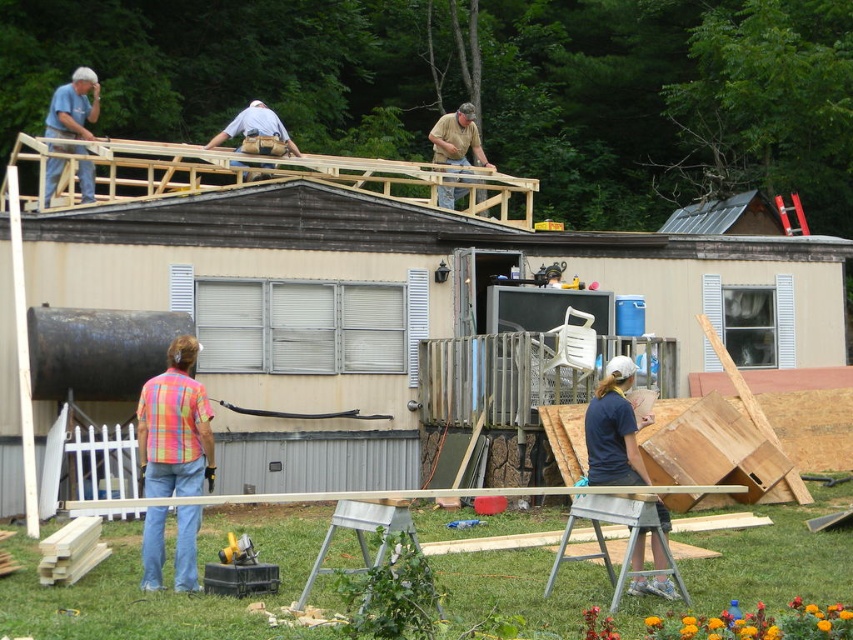
Does point (173, 420) come closer to viewer compared to point (627, 419)?

No, (173, 420) is further to viewer.

Is multicolored plaid shirt at lower left positioned in front of blue fabric shirt at center?

No, it is not.

Is point (177, 364) closer to viewer compared to point (637, 532)?

No, it is not.

Identify the location of multicolored plaid shirt at lower left. This screenshot has height=640, width=853. (173, 426).

Between matte blue shirt at upper left and light blue denim shirt at upper center, which one appears on the left side from the viewer's perspective?

matte blue shirt at upper left

Between matte blue shirt at upper left and light blue denim shirt at upper center, which one is positioned lower?

matte blue shirt at upper left

What do you see at coordinates (73, 106) in the screenshot? I see `matte blue shirt at upper left` at bounding box center [73, 106].

This screenshot has height=640, width=853. I want to click on matte blue shirt at upper left, so click(x=73, y=106).

Can you confirm if multicolored plaid shirt at lower left is taller than light blue denim shirt at upper center?

No, multicolored plaid shirt at lower left is not taller than light blue denim shirt at upper center.

Who is shorter, multicolored plaid shirt at lower left or light blue denim shirt at upper center?

Standing shorter between the two is multicolored plaid shirt at lower left.

Who is more distant from viewer, (189, 419) or (263, 141)?

Point (263, 141)

At what (x,y) coordinates should I click in order to perform the action: click on multicolored plaid shirt at lower left. Please return your answer as a coordinate pair (x, y). The width and height of the screenshot is (853, 640). Looking at the image, I should click on [173, 426].